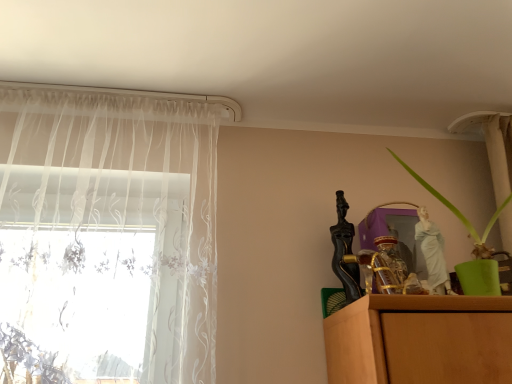
Locate an element on the screen. vacant region above white sheer curtain at left (from a real-world perspective) is located at coordinates (128, 89).